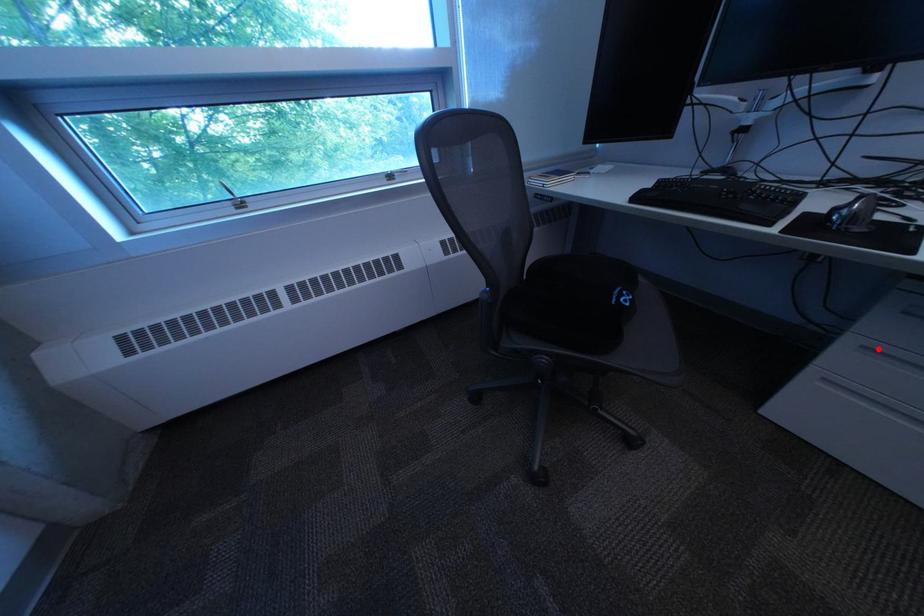
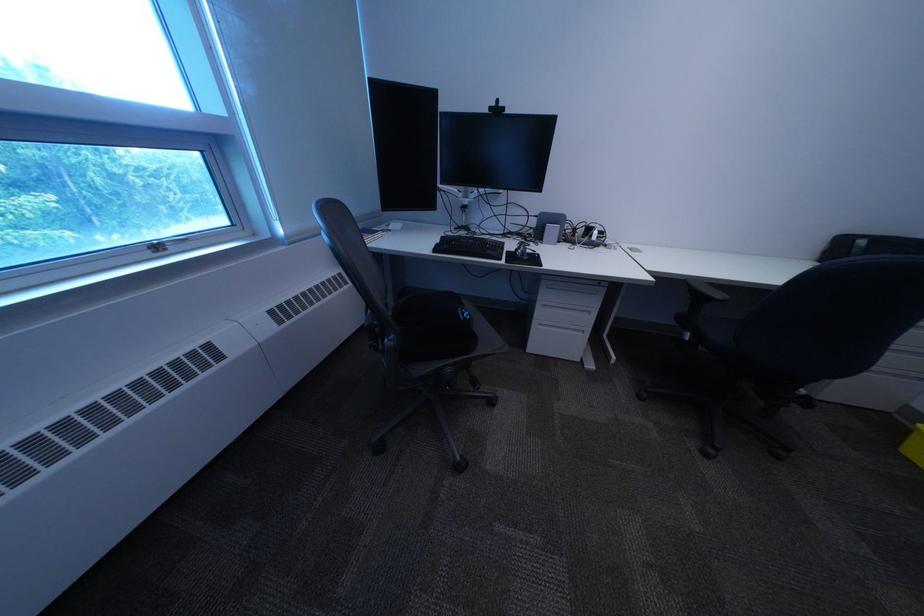
Locate, in the second image, the point that corresponds to the highlighted location in the first image.

(558, 307)